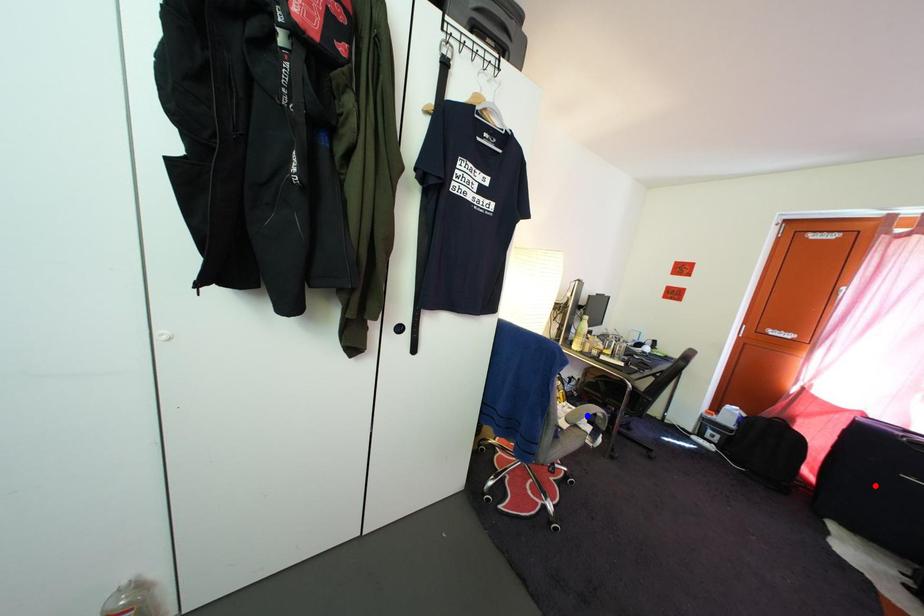
Question: Two points are marked on the image. Which point is closer to the camera?

Choices:
 (A) Blue point is closer.
 (B) Red point is closer.

Answer: (B)